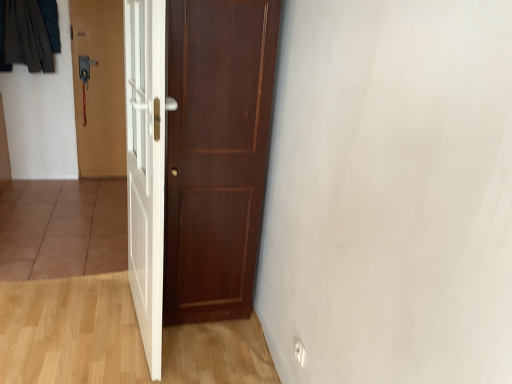
In order to click on vacant space that is to the left of white glossy door at center, which is counted as the 2th door, starting from the left in this screenshot , I will do `click(70, 321)`.